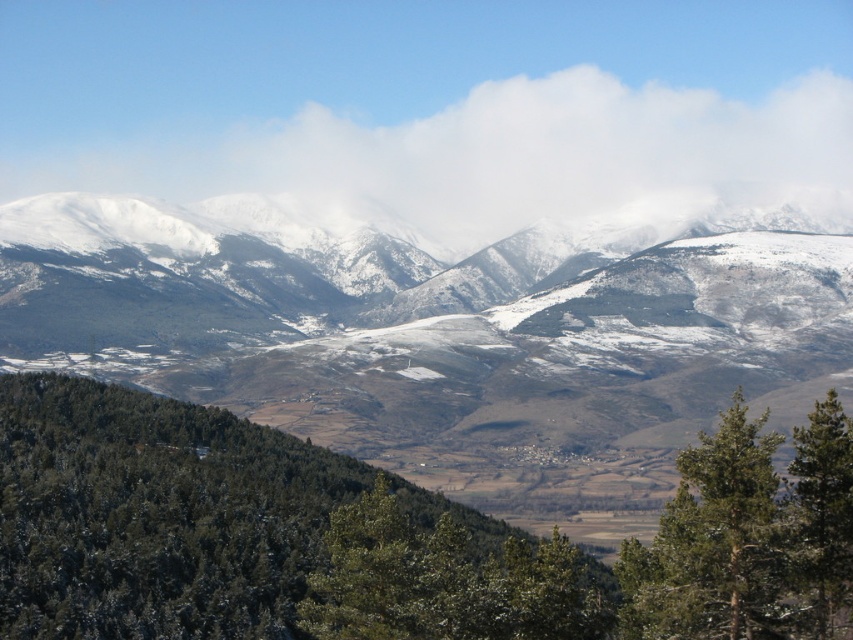
Question: Does white fluffy cloud at upper center come behind green textured tree at lower right?

Choices:
 (A) no
 (B) yes

Answer: (B)

Question: Can you confirm if snowy rocky mountain range at center is thinner than green needle-like tree at lower right?

Choices:
 (A) no
 (B) yes

Answer: (A)

Question: Estimate the real-world distances between objects in this image. Which object is farther from the green textured trees at lower left?

Choices:
 (A) green needle-like tree at lower right
 (B) snowy rocky mountain range at center
 (C) white fluffy cloud at upper center
 (D) green textured tree at lower right

Answer: (C)

Question: Does snowy rocky mountain range at center come in front of white fluffy cloud at upper center?

Choices:
 (A) yes
 (B) no

Answer: (A)

Question: Which object is positioned farthest from the green textured tree at lower right?

Choices:
 (A) snowy rocky mountain range at center
 (B) white fluffy cloud at upper center
 (C) green needle-like tree at lower right
 (D) green textured trees at lower left

Answer: (B)

Question: Considering the real-world distances, which object is farthest from the green textured trees at lower left?

Choices:
 (A) green textured tree at lower right
 (B) white fluffy cloud at upper center
 (C) green needle-like tree at lower right
 (D) snowy rocky mountain range at center

Answer: (B)